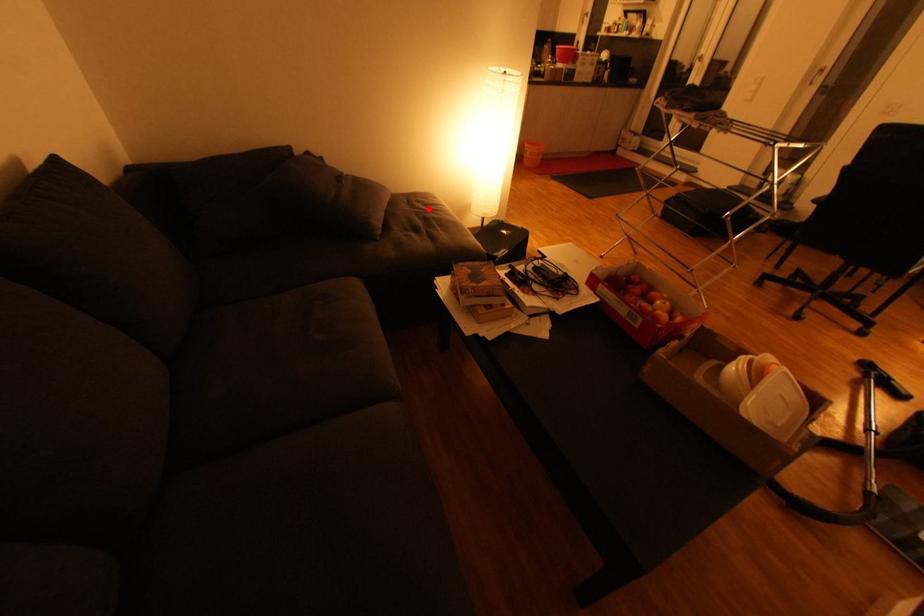
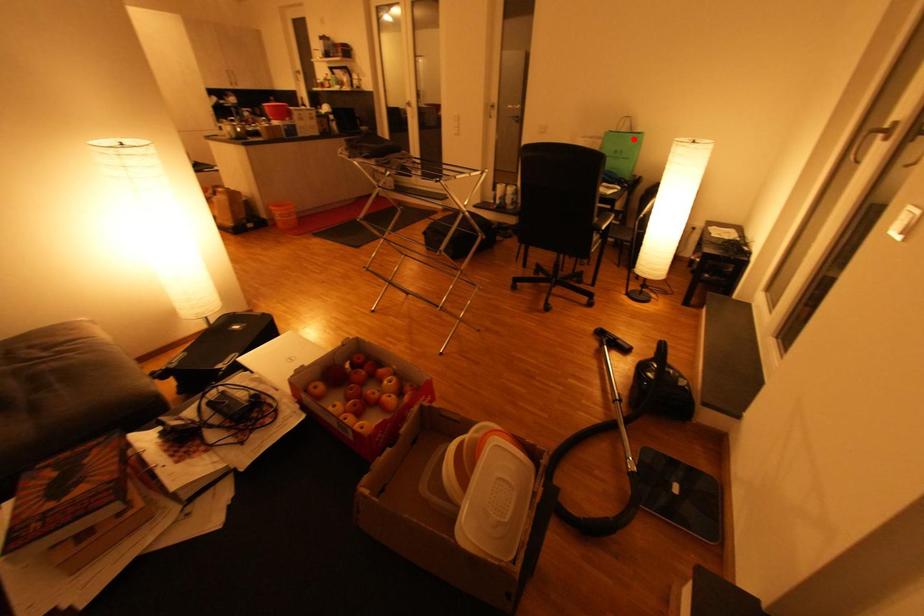
Based on the photo, I am providing you with two images of the same scene from different viewpoints. A red point is marked on the first image and another point is marked on the second image. Is the marked point in image1 the same physical position as the marked point in image2?

No